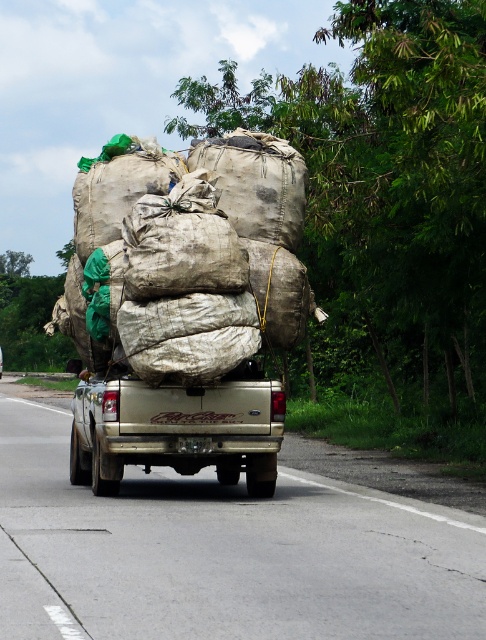
Does gold metallic truck at center appear under gold matte truck at center?

Indeed, gold metallic truck at center is positioned under gold matte truck at center.

Does gold metallic truck at center have a smaller size compared to gold matte truck at center?

Actually, gold metallic truck at center might be larger than gold matte truck at center.

Measure the distance between point (4, 397) and camera.

They are 35.58 meters apart.

The height and width of the screenshot is (640, 486). Find the location of `gold metallic truck at center`. gold metallic truck at center is located at coordinates (222, 554).